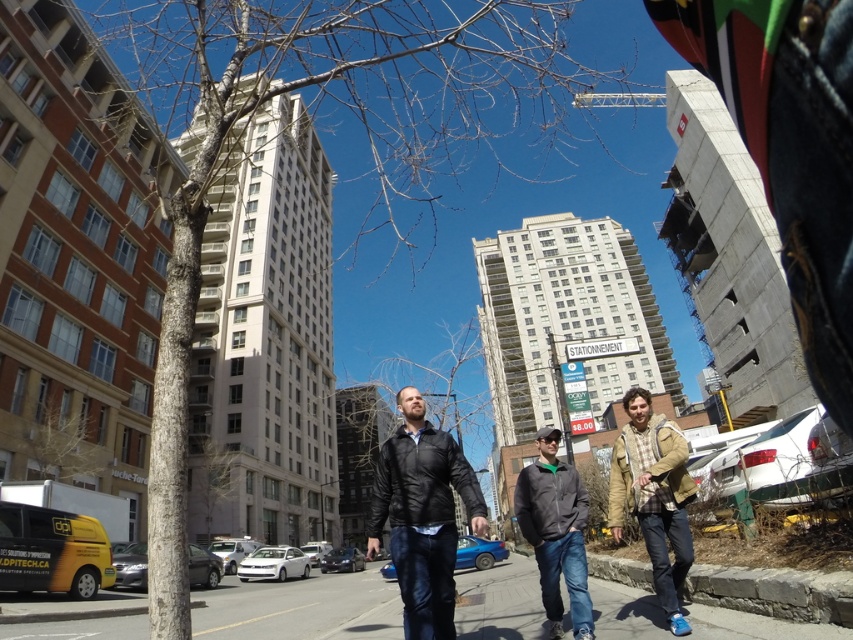
Which is more to the left, gray concrete pavement at lower center or khaki plaid shirt at center?

gray concrete pavement at lower center is more to the left.

Does gray concrete pavement at lower center appear over khaki plaid shirt at center?

Incorrect, gray concrete pavement at lower center is not positioned above khaki plaid shirt at center.

The image size is (853, 640). Find the location of `gray concrete pavement at lower center`. gray concrete pavement at lower center is located at coordinates (300, 609).

Consider the image. Does black leather jacket at center appear over dark gray jacket at center?

No, black leather jacket at center is not above dark gray jacket at center.

Is black leather jacket at center taller than dark gray jacket at center?

Yes, black leather jacket at center is taller than dark gray jacket at center.

What do you see at coordinates (422, 515) in the screenshot? I see `black leather jacket at center` at bounding box center [422, 515].

Locate an element on the screen. The image size is (853, 640). black leather jacket at center is located at coordinates (422, 515).

Measure the distance between gray concrete pavement at lower center and dark gray jacket at center.

gray concrete pavement at lower center and dark gray jacket at center are 7.34 meters apart.

Is point (635, 612) in front of point (525, 504)?

No.

Where is `gray concrete pavement at lower center`? gray concrete pavement at lower center is located at coordinates (300, 609).